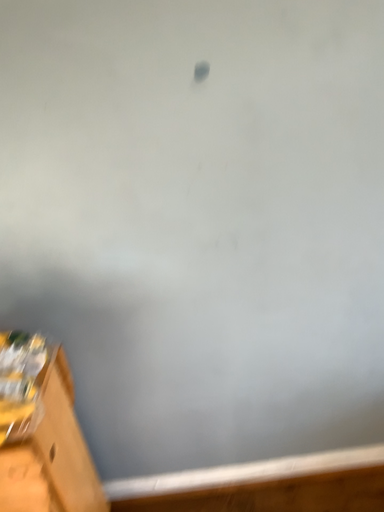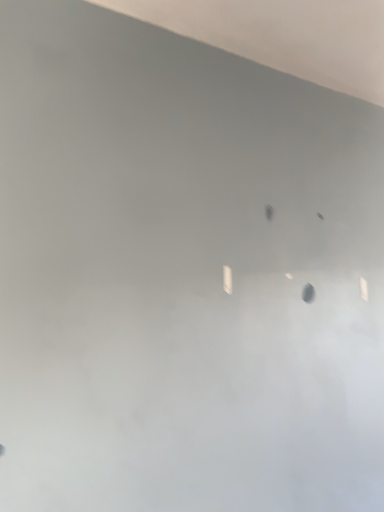
Question: Which way did the camera rotate in the video?

Choices:
 (A) rotated left
 (B) rotated right

Answer: (B)